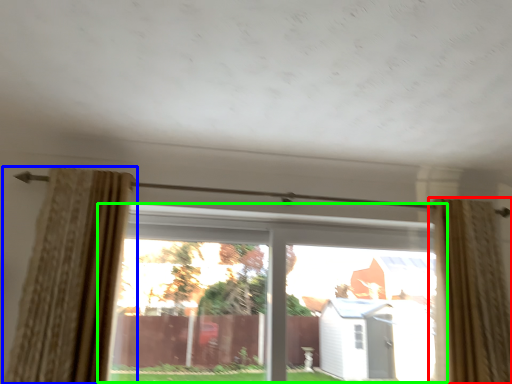
Question: Estimate the real-world distances between objects in this image. Which object is closer to curtain (highlighted by a red box), curtain (highlighted by a blue box) or window (highlighted by a green box)?

Choices:
 (A) curtain
 (B) window

Answer: (B)